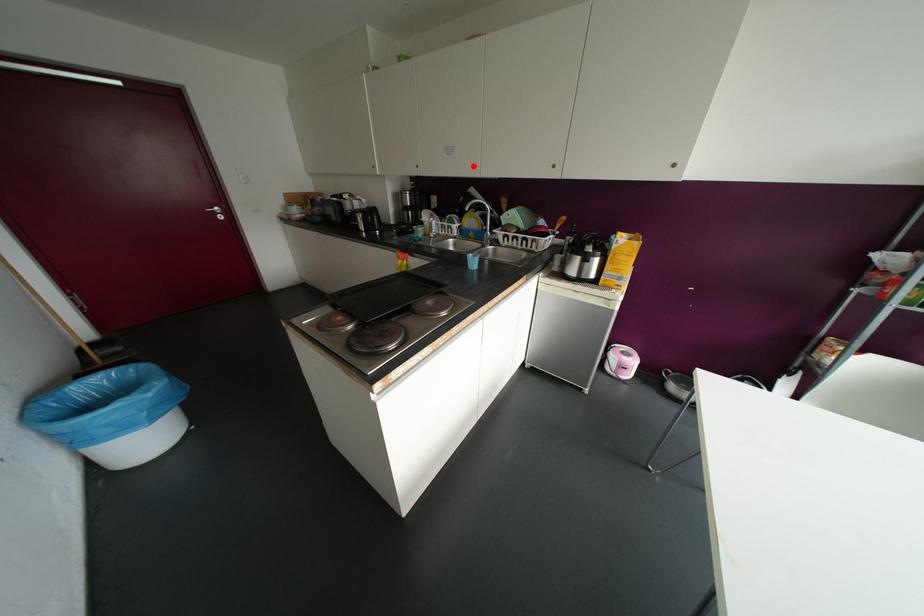
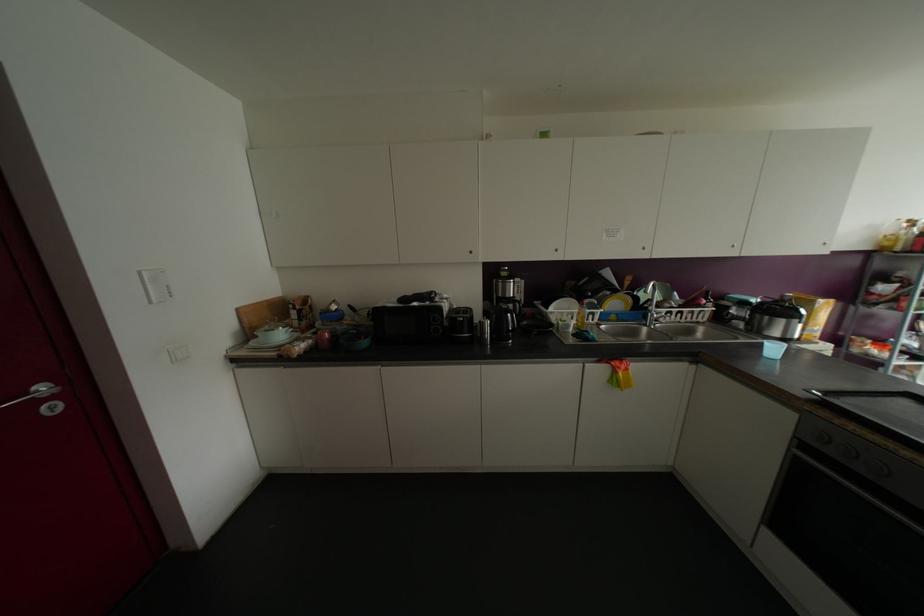
Locate, in the second image, the point that corresponds to the highlighted location in the first image.

(642, 248)